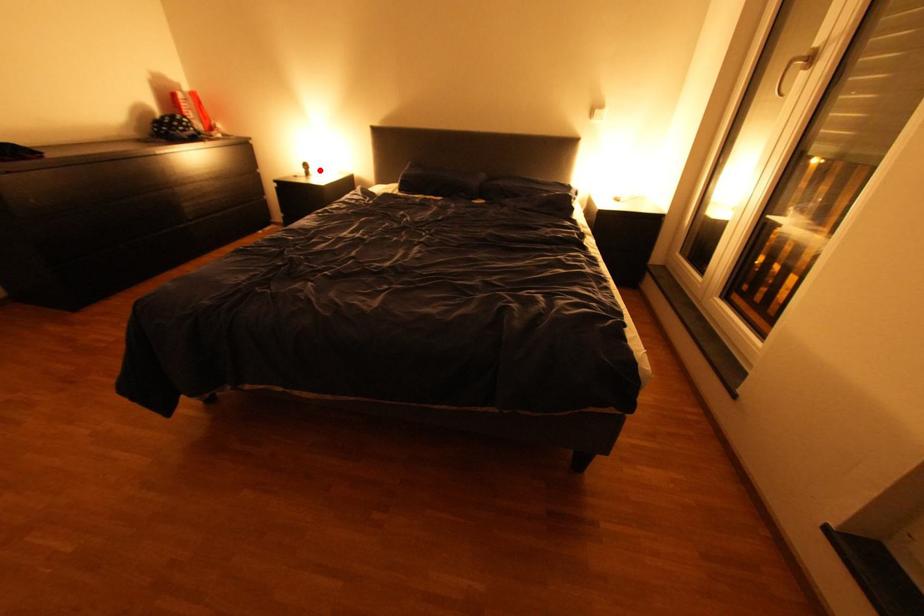
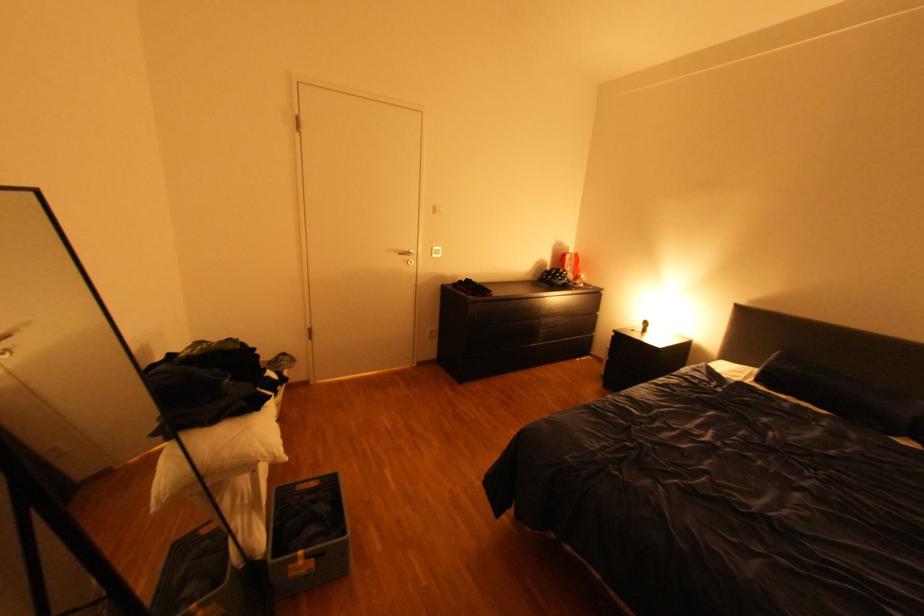
The point at the highlighted location is marked in the first image. Where is the corresponding point in the second image?

(659, 328)